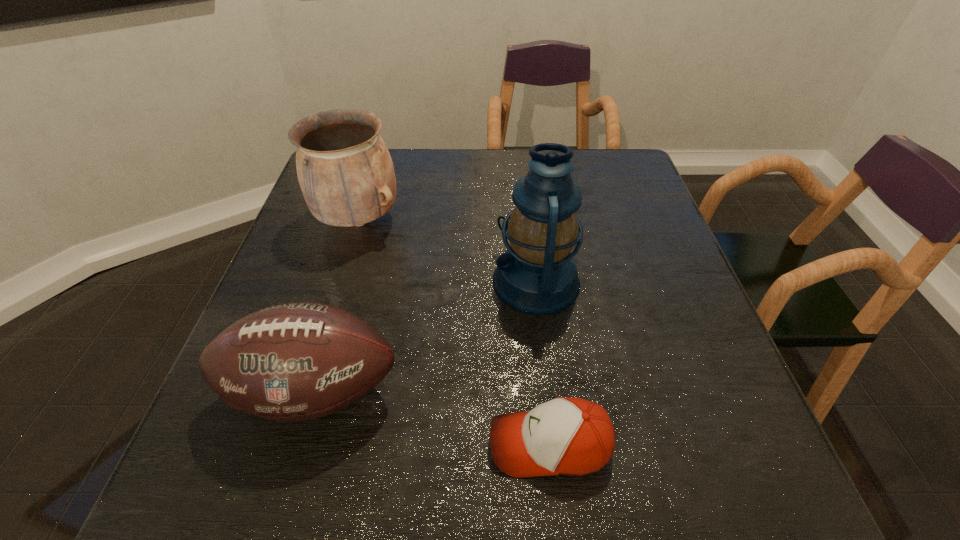
Image resolution: width=960 pixels, height=540 pixels. Find the location of `free space located on the front-facing side of the baseball cap`. free space located on the front-facing side of the baseball cap is located at coordinates (282, 444).

At what (x,y) coordinates should I click in order to perform the action: click on vacant space situated 0.100m on the front-facing side of the baseball cap. Please return your answer as a coordinate pair (x, y). This screenshot has width=960, height=540. Looking at the image, I should click on (428, 444).

The image size is (960, 540). What are the coordinates of `object that is at the near edge` in the screenshot? It's located at (566, 436).

Identify the location of urn that is at the left edge. (345, 171).

This screenshot has width=960, height=540. Find the location of `football (American) at the left edge`. football (American) at the left edge is located at coordinates (297, 361).

In the image, there is a desktop. What are the coordinates of `free region at the far edge` in the screenshot? It's located at (464, 148).

I want to click on vacant space at the near edge, so click(312, 503).

In the image, there is a desktop. At what (x,y) coordinates should I click in order to perform the action: click on free space at the left edge. Please return your answer as a coordinate pair (x, y). The image size is (960, 540). Looking at the image, I should click on pos(308,222).

You are a GUI agent. You are given a task and a screenshot of the screen. Output one action in this format:
    pyautogui.click(x=<x>, y=<y>)
    Task: Click on the vacant region at the right edge of the desktop
    This screenshot has height=540, width=960.
    Given the screenshot: What is the action you would take?
    pyautogui.click(x=670, y=366)

In the image, there is a desktop. Where is `blank space at the far right corner`? This screenshot has height=540, width=960. blank space at the far right corner is located at coordinates (611, 189).